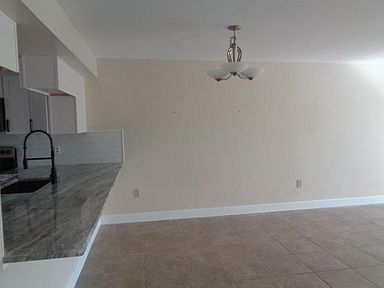
You are a GUI agent. You are given a task and a screenshot of the screen. Output one action in this format:
    pyautogui.click(x=<x>, y=<y>)
    Task: Click on the electrical sockets
    The image size is (384, 288).
    Given the screenshot: What is the action you would take?
    pyautogui.click(x=134, y=193), pyautogui.click(x=298, y=182)